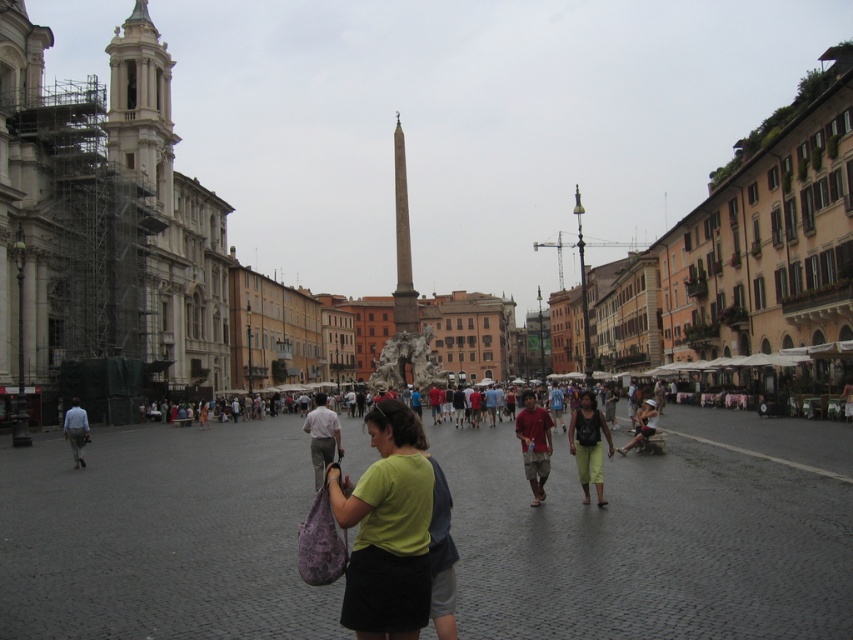
You are a photographer standing in the square and see the light brown cotton shirt at center and the light blue shirt at center. Which one is closer to the ground?

The light brown cotton shirt at center is below the light blue shirt at center, so it is closer to the ground.